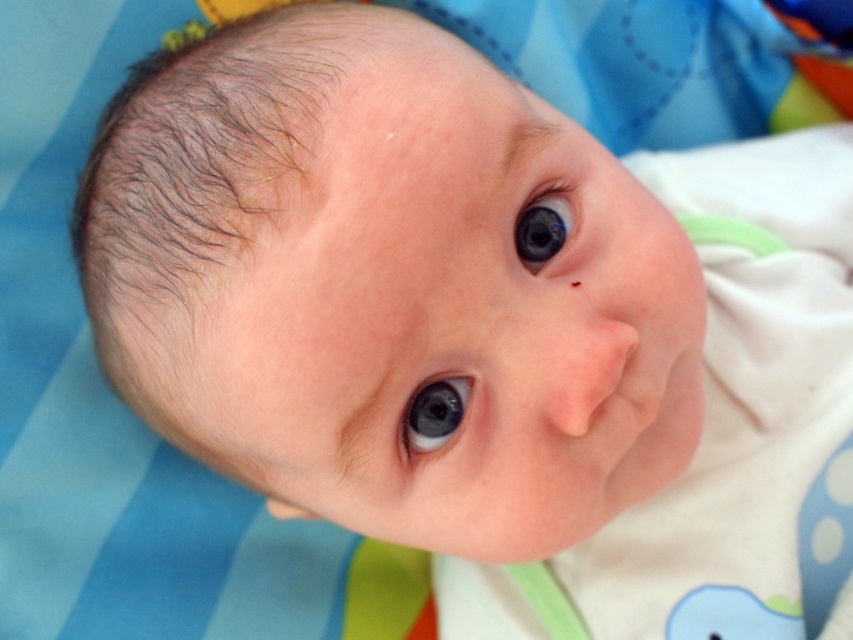
Who is higher up, blue glossy eye at center or glossy blue eye at upper center?

glossy blue eye at upper center

Does blue glossy eye at center appear on the right side of glossy blue eye at upper center?

Incorrect, blue glossy eye at center is not on the right side of glossy blue eye at upper center.

I want to click on blue glossy eye at center, so click(x=434, y=413).